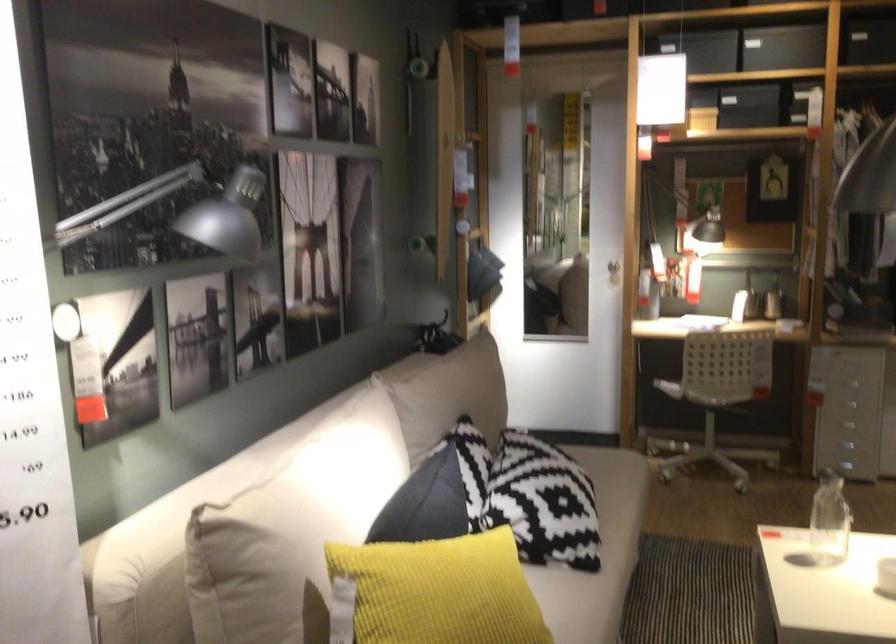
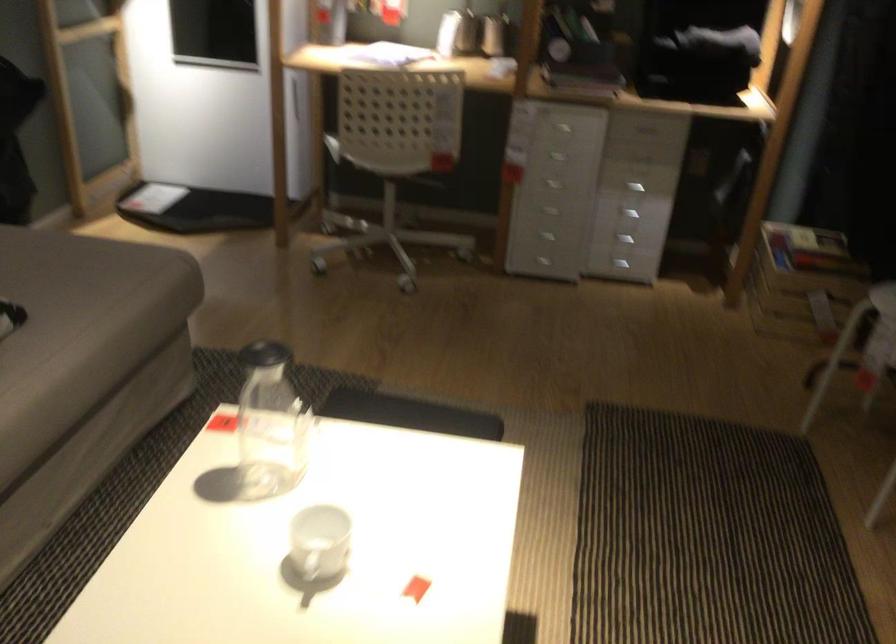
The point at (804, 540) is marked in the first image. Where is the corresponding point in the second image?

(270, 424)